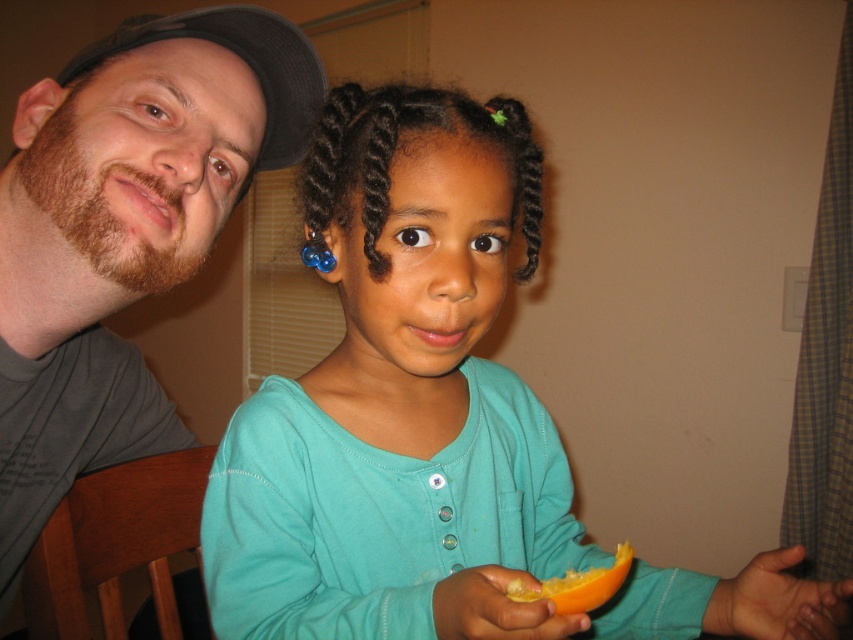
Question: Which of the following is the closest to the observer?

Choices:
 (A) black fabric baseball cap at upper left
 (B) matte gray t-shirt at left

Answer: (B)

Question: Is matte gray t-shirt at left thinner than orange flesh at lower center?

Choices:
 (A) yes
 (B) no

Answer: (B)

Question: Observing the image, what is the correct spatial positioning of matte gray t-shirt at left in reference to orange flesh at lower center?

Choices:
 (A) below
 (B) above

Answer: (B)

Question: Which object is the closest to the black fabric baseball cap at upper left?

Choices:
 (A) orange flesh at lower center
 (B) teal fabric shirt at center

Answer: (B)

Question: Which of the following is the closest to the observer?

Choices:
 (A) black fabric baseball cap at upper left
 (B) teal fabric shirt at center
 (C) matte gray t-shirt at left
 (D) orange flesh at lower center

Answer: (B)

Question: Observing the image, what is the correct spatial positioning of matte gray t-shirt at left in reference to black fabric baseball cap at upper left?

Choices:
 (A) right
 (B) left

Answer: (B)